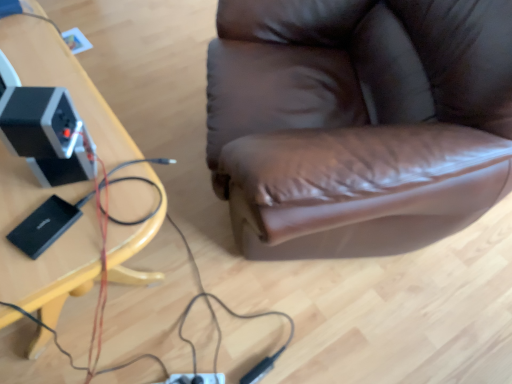
Question: Considering the relative sizes of wooden table at left and black plastic speaker at left in the image provided, is wooden table at left thinner than black plastic speaker at left?

Choices:
 (A) no
 (B) yes

Answer: (A)

Question: Can you confirm if wooden table at left is positioned to the right of black plastic speaker at left?

Choices:
 (A) no
 (B) yes

Answer: (A)

Question: From the image's perspective, is wooden table at left beneath black plastic speaker at left?

Choices:
 (A) no
 (B) yes

Answer: (B)

Question: Is wooden table at left to the left of black plastic speaker at left from the viewer's perspective?

Choices:
 (A) no
 (B) yes

Answer: (B)

Question: Is wooden table at left smaller than black plastic speaker at left?

Choices:
 (A) no
 (B) yes

Answer: (A)

Question: Considering the relative sizes of wooden table at left and black plastic speaker at left in the image provided, is wooden table at left bigger than black plastic speaker at left?

Choices:
 (A) yes
 (B) no

Answer: (A)

Question: Is black plastic speaker at left oriented away from wooden table at left?

Choices:
 (A) no
 (B) yes

Answer: (A)

Question: Does black plastic speaker at left have a larger size compared to wooden table at left?

Choices:
 (A) no
 (B) yes

Answer: (A)

Question: Is black plastic speaker at left facing towards wooden table at left?

Choices:
 (A) yes
 (B) no

Answer: (B)

Question: Can wooden table at left be found inside black plastic speaker at left?

Choices:
 (A) yes
 (B) no

Answer: (B)

Question: Considering the relative positions of black plastic speaker at left and wooden table at left in the image provided, is black plastic speaker at left to the right of wooden table at left from the viewer's perspective?

Choices:
 (A) yes
 (B) no

Answer: (A)

Question: Is black plastic speaker at left in front of wooden table at left?

Choices:
 (A) yes
 (B) no

Answer: (B)

Question: Relative to wooden table at left, is black plastic speaker at left in front or behind?

Choices:
 (A) front
 (B) behind

Answer: (B)